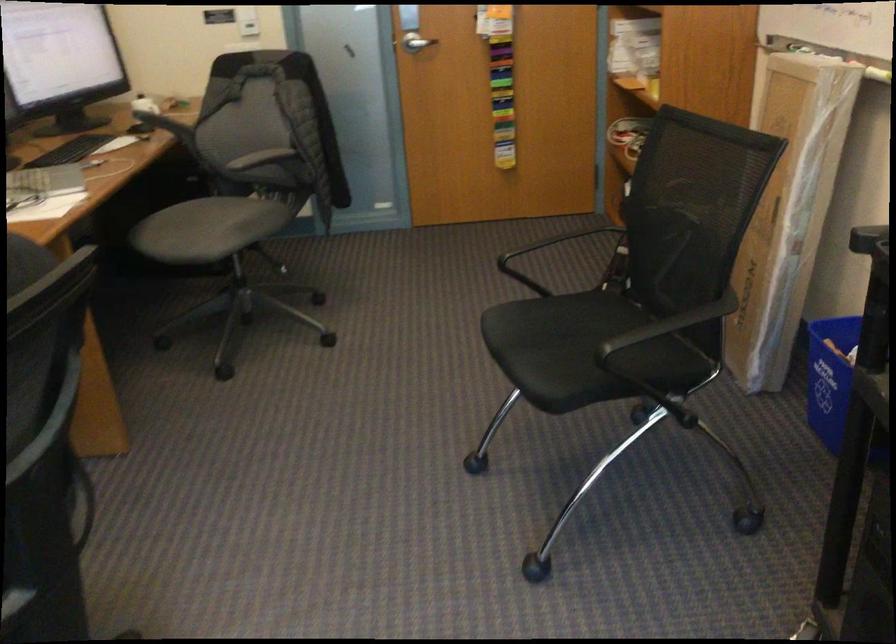
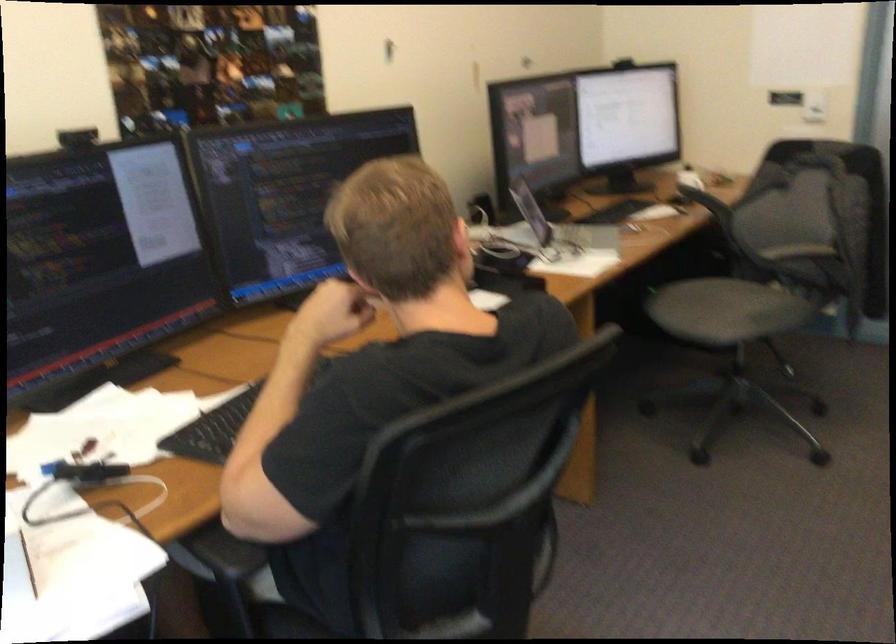
Where in the second image is the point corresponding to the point at 200,236 from the first image?

(709, 308)